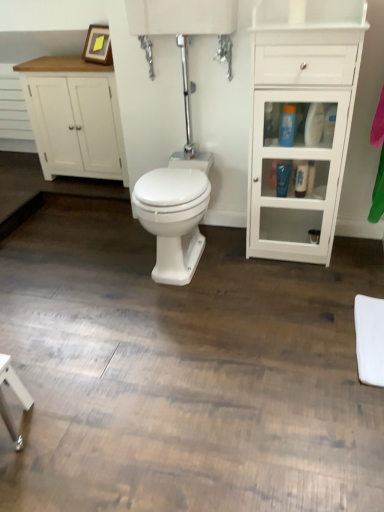
Where is `free region on the left part of white glossy bidet at center`? free region on the left part of white glossy bidet at center is located at coordinates (115, 265).